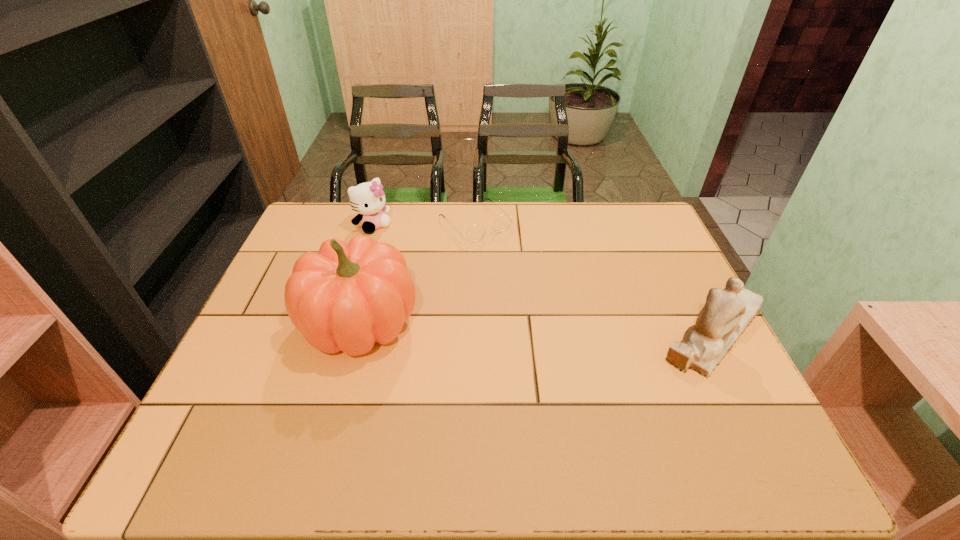
Locate which object ranks in proximity to the rightmost object. Please provide its 2D coordinates. Your answer should be formatted as a tuple, i.e. [(x, y)], where the tuple contains the x and y coordinates of a point satisfying the conditions above.

[(474, 234)]

Find the location of a particular element. vacant space that satisfies the following two spatial constraints: 1. on the back side of the third object from left to right; 2. on the right side of the pumpkin is located at coordinates (388, 223).

You are a GUI agent. You are given a task and a screenshot of the screen. Output one action in this format:
    pyautogui.click(x=<x>, y=<y>)
    Task: Click on the blank space that satisfies the following two spatial constraints: 1. on the front side of the rightmost object; 2. on the front-facing side of the kitten
    
    Given the screenshot: What is the action you would take?
    pyautogui.click(x=341, y=331)

Locate an element on the screen. The width and height of the screenshot is (960, 540). free spot that satisfies the following two spatial constraints: 1. on the front side of the rightmost object; 2. on the front-facing side of the tallest object is located at coordinates (358, 331).

Where is `free space that satisfies the following two spatial constraints: 1. on the front side of the rightmost object; 2. on the front-facing side of the second object from right to left`? free space that satisfies the following two spatial constraints: 1. on the front side of the rightmost object; 2. on the front-facing side of the second object from right to left is located at coordinates (473, 331).